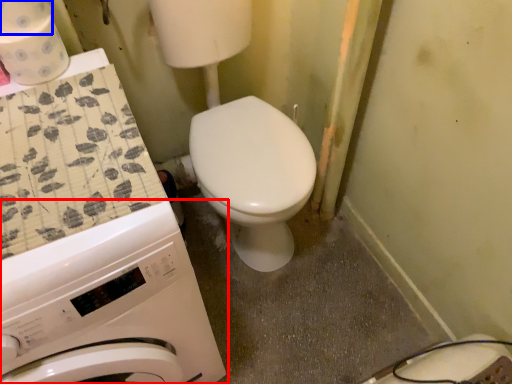
Question: Which object appears closest to the camera in this image, washing machine (highlighted by a red box) or toilet paper (highlighted by a blue box)?

Choices:
 (A) washing machine
 (B) toilet paper

Answer: (A)